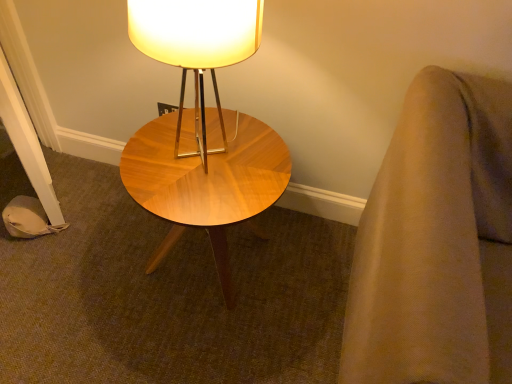
Question: In the image, is wooden lampshade at center on the left side or the right side of woodenwoodencoffee table at center?

Choices:
 (A) left
 (B) right

Answer: (B)

Question: Considering the positions of point pyautogui.click(x=135, y=26) and point pyautogui.click(x=224, y=273), is point pyautogui.click(x=135, y=26) closer or farther from the camera than point pyautogui.click(x=224, y=273)?

Choices:
 (A) closer
 (B) farther

Answer: (A)

Question: From the image's perspective, is wooden lampshade at center above or below woodenwoodencoffee table at center?

Choices:
 (A) above
 (B) below

Answer: (A)

Question: Considering the positions of woodenwoodencoffee table at center and wooden lampshade at center in the image, is woodenwoodencoffee table at center bigger or smaller than wooden lampshade at center?

Choices:
 (A) small
 (B) big

Answer: (B)

Question: In the image, is woodenwoodencoffee table at center positioned in front of or behind wooden lampshade at center?

Choices:
 (A) front
 (B) behind

Answer: (B)

Question: Which is correct: woodenwoodencoffee table at center is inside wooden lampshade at center, or outside of it?

Choices:
 (A) outside
 (B) inside

Answer: (A)

Question: From a real-world perspective, relative to wooden lampshade at center, is woodenwoodencoffee table at center vertically above or below?

Choices:
 (A) above
 (B) below

Answer: (B)